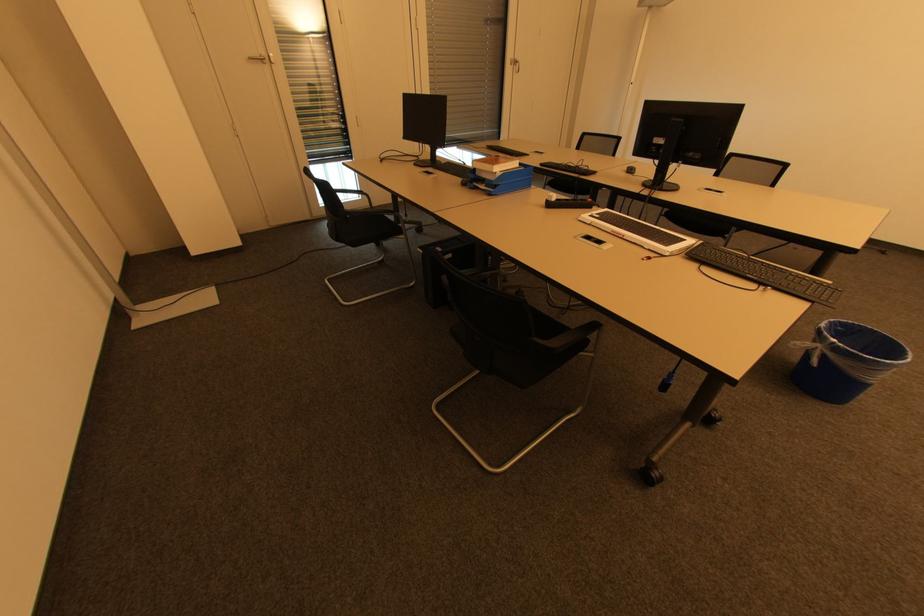
At what (x,y) coordinates should I click in order to perform the action: click on black computer mouse. Please return your answer as a coordinate pair (x, y). Looking at the image, I should click on (636, 169).